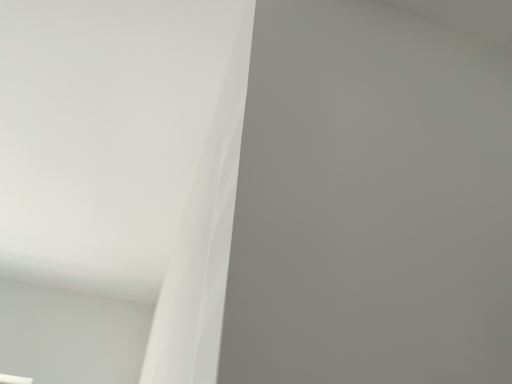
The width and height of the screenshot is (512, 384). What do you see at coordinates (370, 203) in the screenshot?
I see `white matte wall at center` at bounding box center [370, 203].

Locate an element on the screen. The image size is (512, 384). white matte wall at center is located at coordinates (370, 203).

The width and height of the screenshot is (512, 384). I want to click on white matte wall at center, so click(370, 203).